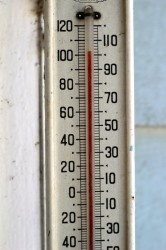
This screenshot has height=250, width=166. Identify the location of tile. (154, 181), (143, 94).